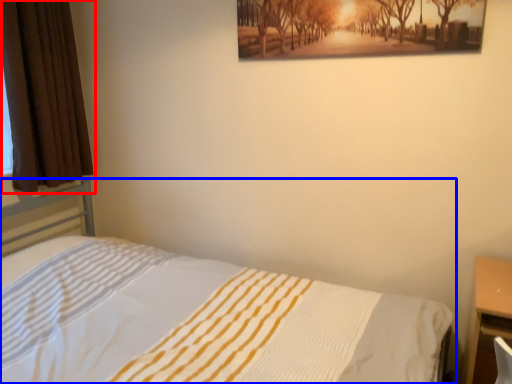
Question: Which object is further to the camera taking this photo, curtain (highlighted by a red box) or bed (highlighted by a blue box)?

Choices:
 (A) curtain
 (B) bed

Answer: (A)